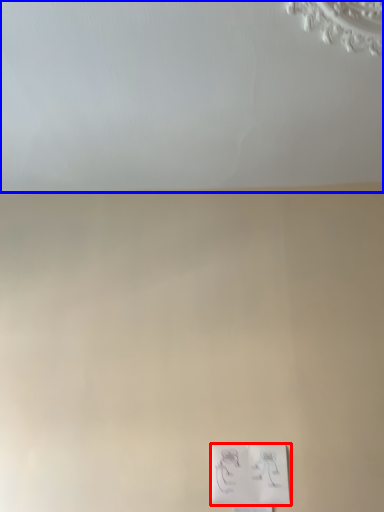
Question: Which of the following is the farthest to the observer, light switch (highlighted by a red box) or backdrop (highlighted by a blue box)?

Choices:
 (A) light switch
 (B) backdrop

Answer: (A)